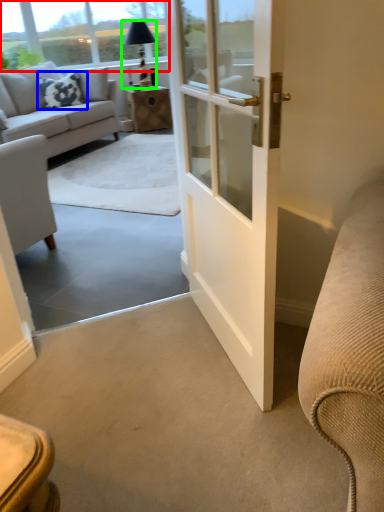
Question: Considering the real-world distances, which object is closest to window screen (highlighted by a red box)? pillow (highlighted by a blue box) or lamp (highlighted by a green box).

Choices:
 (A) pillow
 (B) lamp

Answer: (B)